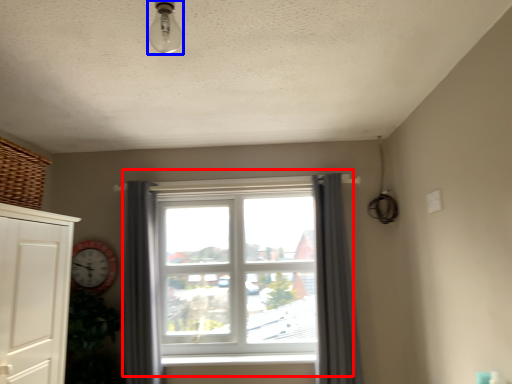
Question: Which object appears closest to the camera in this image, window (highlighted by a red box) or light fixture (highlighted by a blue box)?

Choices:
 (A) window
 (B) light fixture

Answer: (B)